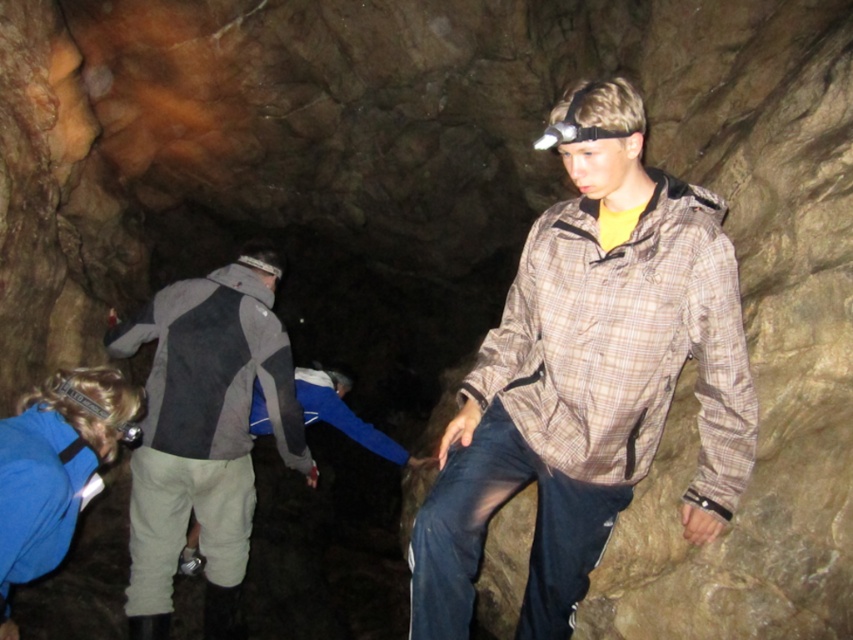
Does brown plaid jacket at center have a larger size compared to gray/black fabric jacket at center?

No, brown plaid jacket at center is not bigger than gray/black fabric jacket at center.

Does point (654, 428) come closer to viewer compared to point (213, 296)?

That is True.

This screenshot has height=640, width=853. Describe the element at coordinates (589, 376) in the screenshot. I see `brown plaid jacket at center` at that location.

Locate an element on the screen. This screenshot has width=853, height=640. brown plaid jacket at center is located at coordinates (589, 376).